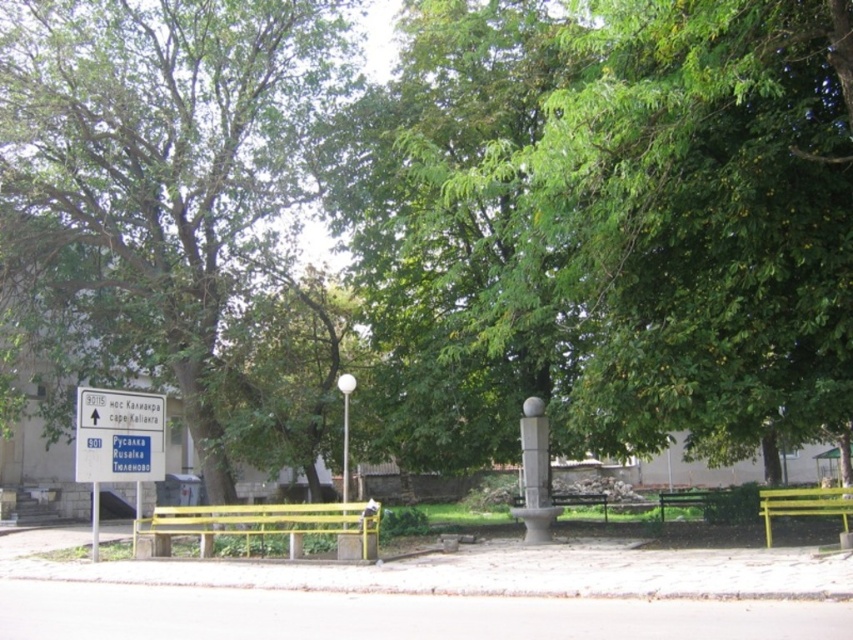
You are standing at the center of the square and want to sit down. Which object, the green painted wood bench at lower right or the white glossy pole at center, is located to your right side?

The green painted wood bench at lower right is located to your right side as it is positioned to the right of the white glossy pole at center.

You are planning to take a photo of the white plastic sign at left and the green leafy tree at left. Which object should you focus on first if you want to capture both in a single frame without moving the camera?

The green leafy tree at left is larger than the white plastic sign at left, so you should focus on the green leafy tree at left first to ensure it fits properly in the frame.